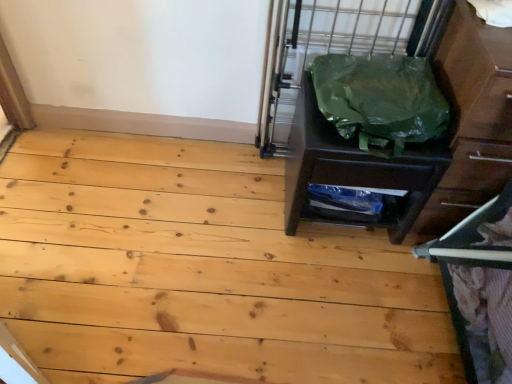
Measure the distance between green plastic bag at right and camera.

They are 1.13 meters apart.

At what (x,y) coordinates should I click in order to perform the action: click on green plastic bag at right. Please return your answer as a coordinate pair (x, y). The height and width of the screenshot is (384, 512). Looking at the image, I should click on (422, 144).

Measure the distance between point (460,179) and camera.

A distance of 4.72 feet exists between point (460,179) and camera.

At what (x,y) coordinates should I click in order to perform the action: click on green plastic bag at right. Please return your answer as a coordinate pair (x, y). Image resolution: width=512 pixels, height=384 pixels. Looking at the image, I should click on (380, 100).

This screenshot has width=512, height=384. Find the location of `natural wood floor at center`. natural wood floor at center is located at coordinates (201, 271).

Identify the location of green plastic bag at right. Image resolution: width=512 pixels, height=384 pixels. (422, 144).

Based on the photo, from the image's perspective, between matte brown dresser at right and metallic gray bunk bed at right, which one is located above?

matte brown dresser at right appears higher in the image.

Is point (498, 33) farther from camera compared to point (453, 286)?

No, (498, 33) is closer to viewer.

Does matte brown dresser at right lie behind metallic gray bunk bed at right?

Yes, matte brown dresser at right is behind metallic gray bunk bed at right.

Can you confirm if matte brown dresser at right is wider than metallic gray bunk bed at right?

Yes, matte brown dresser at right is wider than metallic gray bunk bed at right.

Is natural wood floor at center not close to green plastic bag at right?

They are positioned close to each other.

Can you confirm if natural wood floor at center is positioned to the right of green plastic bag at right?

No.

From a real-world perspective, between natural wood floor at center and green plastic bag at right, who is vertically lower?

natural wood floor at center is physically lower.

In the image, is natural wood floor at center positioned in front of or behind green plastic bag at right?

Visually, natural wood floor at center is located in front of green plastic bag at right.

Considering the sizes of objects green plastic bag at right and green plastic bag at right in the image provided, who is shorter, green plastic bag at right or green plastic bag at right?

green plastic bag at right.

From the image's perspective, is green plastic bag at right under green plastic bag at right?

Yes.

Is green plastic bag at right far from green plastic bag at right?

green plastic bag at right is near green plastic bag at right, not far away.

In the scene shown: Considering the positions of objects green plastic bag at right and green plastic bag at right in the image provided, who is more to the right, green plastic bag at right or green plastic bag at right?

From the viewer's perspective, green plastic bag at right appears more on the right side.

Does matte brown dresser at right have a lesser height compared to green plastic bag at right?

Incorrect, the height of matte brown dresser at right does not fall short of that of green plastic bag at right.

From a real-world perspective, which is physically above, matte brown dresser at right or green plastic bag at right?

In real-world perspective, green plastic bag at right is above.

You are a GUI agent. You are given a task and a screenshot of the screen. Output one action in this format:
    pyautogui.click(x=<x>, y=<y>)
    Task: Click on the dresser on the right of green plastic bag at right
    The height and width of the screenshot is (384, 512).
    Given the screenshot: What is the action you would take?
    pyautogui.click(x=472, y=118)

Can you confirm if metallic gray bunk bed at right is bigger than natural wood floor at center?

Indeed, metallic gray bunk bed at right has a larger size compared to natural wood floor at center.

Is metallic gray bunk bed at right inside or outside of natural wood floor at center?

metallic gray bunk bed at right cannot be found inside natural wood floor at center.

From a real-world perspective, which object stands above the other?

metallic gray bunk bed at right, from a real-world perspective.

Does metallic gray bunk bed at right turn towards natural wood floor at center?

Yes, metallic gray bunk bed at right faces towards natural wood floor at center.

Is natural wood floor at center oriented towards green plastic bag at right?

No, natural wood floor at center is not aimed at green plastic bag at right.

From their relative heights in the image, would you say natural wood floor at center is taller or shorter than green plastic bag at right?

In the image, natural wood floor at center appears to be shorter than green plastic bag at right.

Is natural wood floor at center located outside green plastic bag at right?

Yes, natural wood floor at center is outside of green plastic bag at right.

Considering the points (203, 300) and (438, 101), which point is behind, point (203, 300) or point (438, 101)?

The point (203, 300) is farther from the camera.

I want to click on garbage above the metallic gray bunk bed at right (from a real-world perspective), so tap(380, 100).

Would you consider metallic gray bunk bed at right to be distant from green plastic bag at right?

metallic gray bunk bed at right is actually quite close to green plastic bag at right.

Is metallic gray bunk bed at right positioned before green plastic bag at right?

Yes, metallic gray bunk bed at right is closer to the viewer.

Can you confirm if metallic gray bunk bed at right is thinner than green plastic bag at right?

Correct, the width of metallic gray bunk bed at right is less than that of green plastic bag at right.

The width and height of the screenshot is (512, 384). Find the location of `dresser above the metallic gray bunk bed at right (from the image's perspective)`. dresser above the metallic gray bunk bed at right (from the image's perspective) is located at coordinates (472, 118).

Where is `plywood that is on the left side of green plastic bag at right`? This screenshot has height=384, width=512. plywood that is on the left side of green plastic bag at right is located at coordinates (201, 271).

Looking at the image, which one is located further to green plastic bag at right, metallic gray bunk bed at right or green plastic bag at right?

metallic gray bunk bed at right lies further to green plastic bag at right than the other object.

Looking at the image, which one is located closer to green plastic bag at right, matte brown dresser at right or green plastic bag at right?

matte brown dresser at right.

Which object lies nearer to the anchor point green plastic bag at right, matte brown dresser at right or green plastic bag at right?

green plastic bag at right lies closer to green plastic bag at right than the other object.

From the image, which object appears to be farther from metallic gray bunk bed at right, green plastic bag at right or green plastic bag at right?

green plastic bag at right.

From the image, which object appears to be farther from metallic gray bunk bed at right, matte brown dresser at right or natural wood floor at center?

natural wood floor at center lies further to metallic gray bunk bed at right than the other object.

Based on their spatial positions, is natural wood floor at center or matte brown dresser at right further from metallic gray bunk bed at right?

natural wood floor at center is positioned further to the anchor metallic gray bunk bed at right.

Looking at the image, which one is located closer to natural wood floor at center, metallic gray bunk bed at right or green plastic bag at right?

metallic gray bunk bed at right.

Which object lies further to the anchor point green plastic bag at right, matte brown dresser at right or natural wood floor at center?

natural wood floor at center is further to green plastic bag at right.

Locate an element on the screen. This screenshot has height=384, width=512. garbage situated between natural wood floor at center and matte brown dresser at right from left to right is located at coordinates (380, 100).

I want to click on garbage located between green plastic bag at right and matte brown dresser at right in the left-right direction, so click(380, 100).

Identify the location of chest of drawers between natural wood floor at center and metallic gray bunk bed at right in the horizontal direction. This screenshot has height=384, width=512. (422, 144).

Locate an element on the screen. bunk bed situated between natural wood floor at center and matte brown dresser at right from left to right is located at coordinates (480, 287).